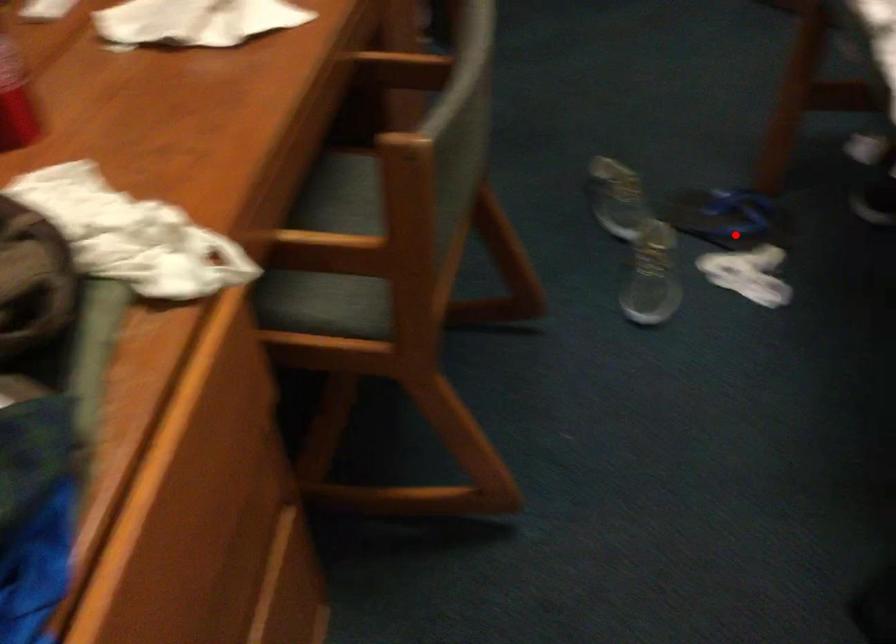
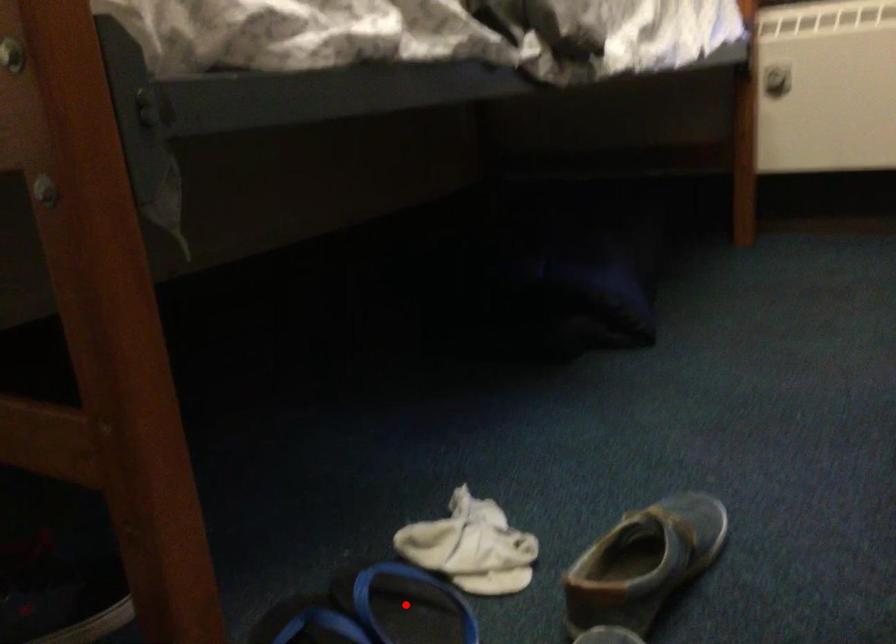
I am providing you with two images of the same scene from different viewpoints. A red point is marked on the first image and another point is marked on the second image. Does the point marked in image1 correspond to the same location as the one in image2?

Yes